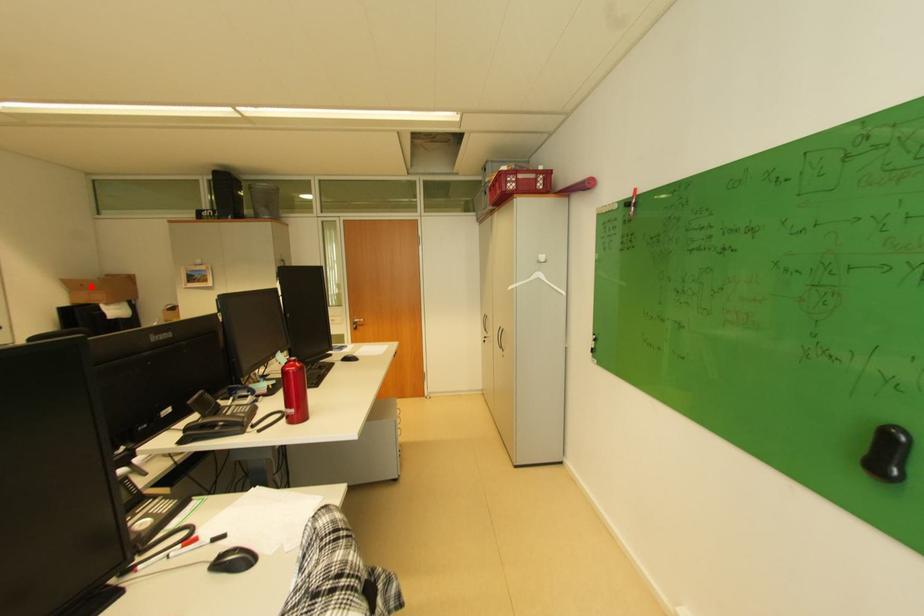
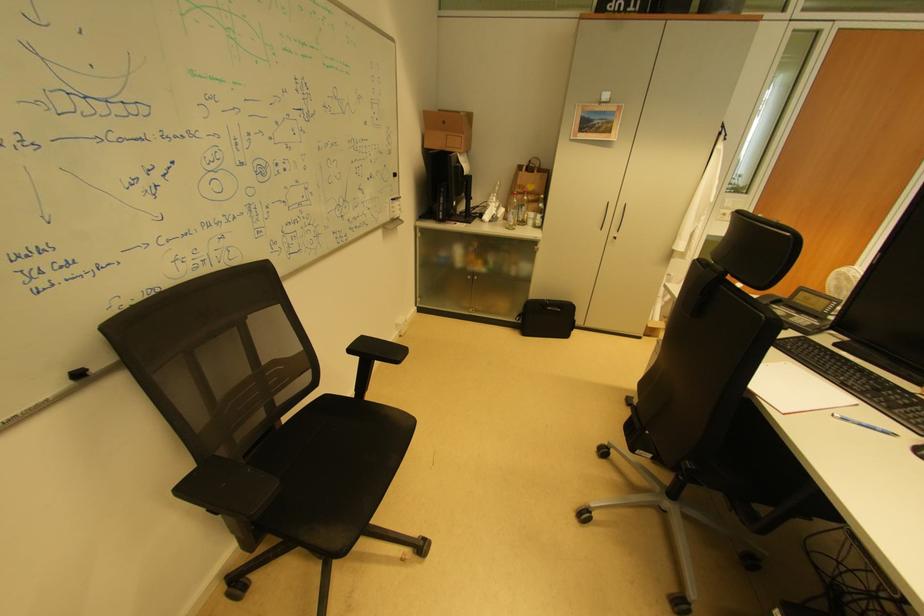
Question: I am providing you with two images of the same scene from different viewpoints. Given a red point in image1, look at the same physical point in image2. Is it:

Choices:
 (A) Closer to the viewpoint
 (B) Farther from the viewpoint

Answer: (A)